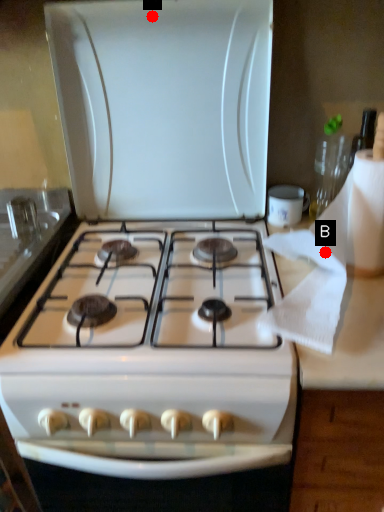
Question: Two points are circled on the image, labeled by A and B beside each circle. Which of the following is the farthest from the observer?

Choices:
 (A) A is further
 (B) B is further

Answer: (A)